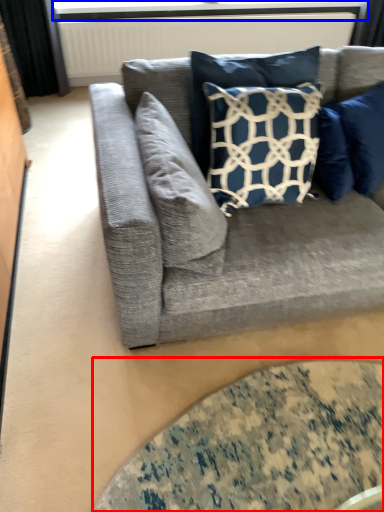
Question: Which of the following is the closest to the observer, glass table (highlighted by a red box) or window screen (highlighted by a blue box)?

Choices:
 (A) glass table
 (B) window screen

Answer: (A)